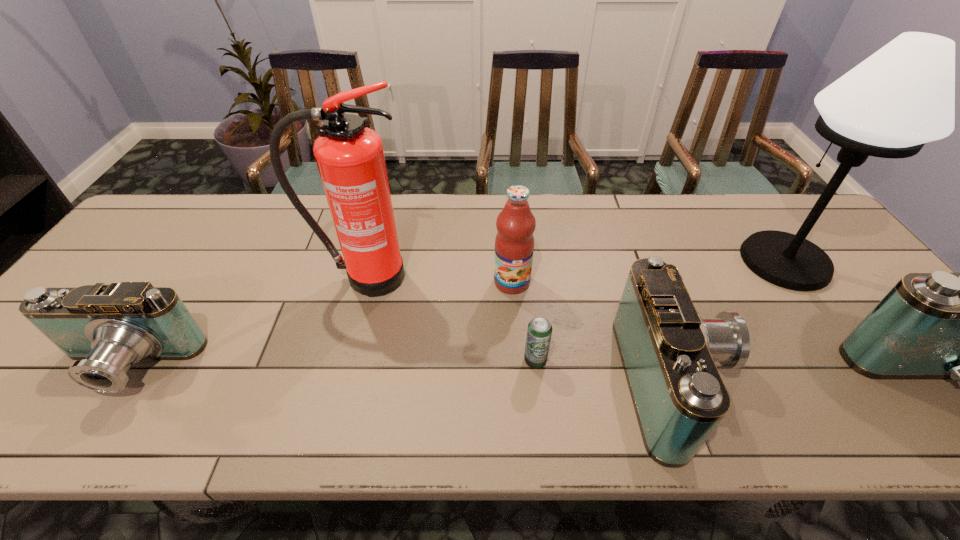
Find the location of a particular element. vacant space at the near edge is located at coordinates (361, 372).

Image resolution: width=960 pixels, height=540 pixels. Identify the location of free region at the right edge of the desktop. (858, 323).

At what (x,y) coordinates should I click in order to perform the action: click on free location at the far left corner of the desktop. Please return your answer as a coordinate pair (x, y). The width and height of the screenshot is (960, 540). Looking at the image, I should click on click(x=155, y=228).

This screenshot has width=960, height=540. What are the coordinates of `vacant area between the fruit juice and the beer can` in the screenshot? It's located at (523, 321).

The height and width of the screenshot is (540, 960). Find the location of `vacant space that's between the table lamp and the fire extinguisher`. vacant space that's between the table lamp and the fire extinguisher is located at coordinates (574, 269).

You are a GUI agent. You are given a task and a screenshot of the screen. Output one action in this format:
    pyautogui.click(x=<x>, y=<y>)
    Task: Click on the unoccupied position between the second camcorder from left to right and the sixth object from right to left
    
    Given the screenshot: What is the action you would take?
    pyautogui.click(x=520, y=329)

Find the location of `free space between the fifth object from left to right and the fruit juice`. free space between the fifth object from left to right and the fruit juice is located at coordinates (594, 332).

This screenshot has width=960, height=540. I want to click on vacant space that's between the second object from left to right and the leftmost camcorder, so click(245, 322).

In order to click on free space between the shortest object and the leftmost camcorder in this screenshot , I will do `click(330, 363)`.

I want to click on vacant space in between the leftmost camcorder and the shortest object, so click(x=330, y=363).